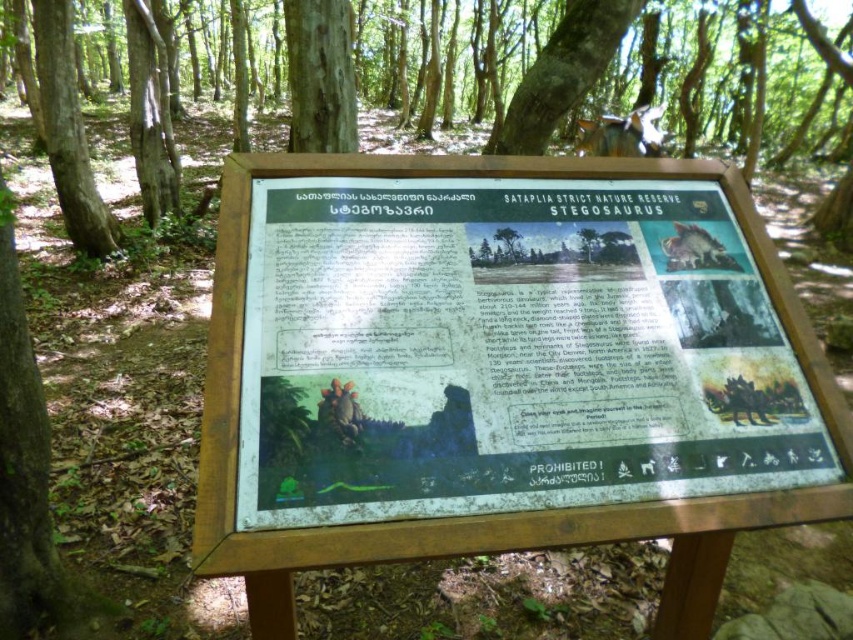
Consider the image. You are a hiker who wants to identify the largest tree in the area. Looking at the signboard, which of the two trees mentioned, the smooth bark tree at upper center or the smooth brown bark at upper center, is larger?

The smooth bark tree at upper center is larger in size than the smooth brown bark at upper center, so the smooth bark tree at upper center is the larger one.

You are a hiker standing at the base of the tree with smooth brown bark at upper center. You want to place a 3 meter long ladder against the tree to reach the signboard mounted on it. Is the ladder long enough to reach the signboard?

The smooth brown bark at upper center and viewer are 2.79 meters apart. The ladder is 3 meters long, which is longer than the distance between you and the tree, so the ladder is long enough to reach the signboard.